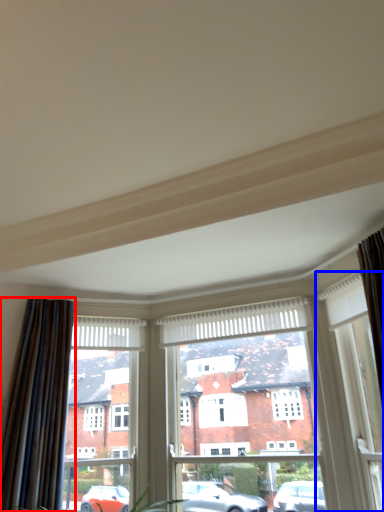
Question: Which point is closer to the camera, curtain (highlighted by a red box) or window (highlighted by a blue box)?

Choices:
 (A) curtain
 (B) window

Answer: (B)